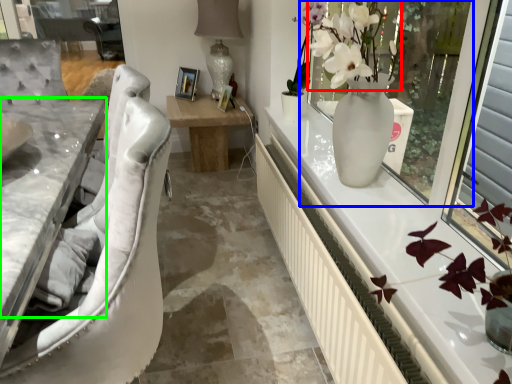
Question: Which object is the closest to the floral arrangement (highlighted by a red box)? Choose among these: window screen (highlighted by a blue box) or counter top (highlighted by a green box).

Choices:
 (A) window screen
 (B) counter top

Answer: (A)